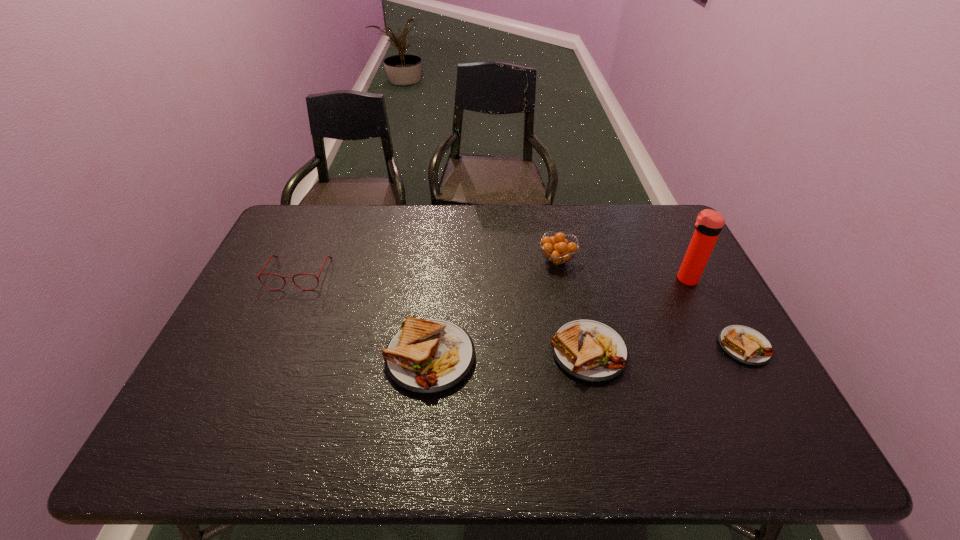
You are a GUI agent. You are given a task and a screenshot of the screen. Output one action in this format:
    pyautogui.click(x=<x>, y=<y>)
    Task: Click on the empty space between the thermos bottle and the second object from left to right
    The width and height of the screenshot is (960, 540).
    Given the screenshot: What is the action you would take?
    pyautogui.click(x=558, y=318)

At what (x,y) coordinates should I click in order to perform the action: click on object that is the nearest to the leftmost object. Please return your answer as a coordinate pair (x, y). The image size is (960, 540). Looking at the image, I should click on (426, 356).

Identify which object is the fourth nearest to the tallest object. Please provide its 2D coordinates. Your answer should be formatted as a tuple, i.e. [(x, y)], where the tuple contains the x and y coordinates of a point satisfying the conditions above.

[(426, 356)]

Identify the location of the third closest sandwich to the thermos bottle. The image size is (960, 540). (426, 356).

The width and height of the screenshot is (960, 540). Identify the location of sandwich identified as the closest to the leftmost sandwich. (589, 350).

Locate an element on the screen. The image size is (960, 540). free space that satisfies the following two spatial constraints: 1. on the back side of the shortest sandwich; 2. on the right side of the second shortest sandwich is located at coordinates (588, 346).

Image resolution: width=960 pixels, height=540 pixels. Find the location of `free space that satisfies the following two spatial constraints: 1. on the back side of the thermos bottle; 2. on the right side of the fifth object from right to left`. free space that satisfies the following two spatial constraints: 1. on the back side of the thermos bottle; 2. on the right side of the fifth object from right to left is located at coordinates (438, 279).